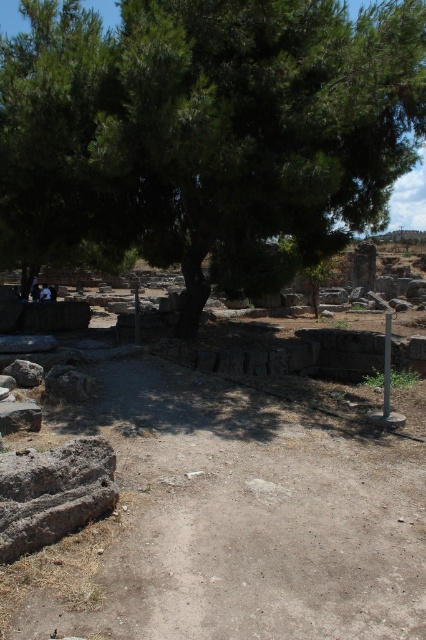
You are an archaeologist standing at the point closer to the edge of the archaeological site. You notice two points marked on your map corresponding to potential excavation spots. The first is labeled as point (379, 108) and the second as point (383, 394). Based on the image, which point is farther from your current position?

Point (379, 108) is behind point (383, 394), so if you are standing at the point closer to the edge of the archaeological site, point (379, 108) would be farther from your current position.